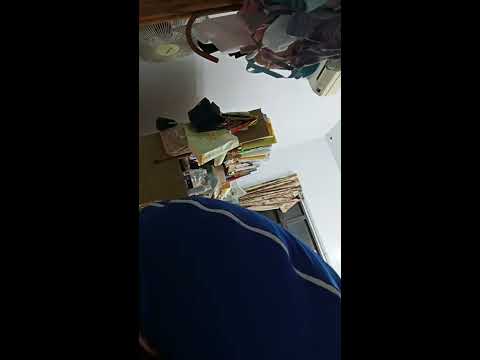
Locate an element on the screen. Image resolution: width=480 pixels, height=360 pixels. furniture is located at coordinates (171, 175).